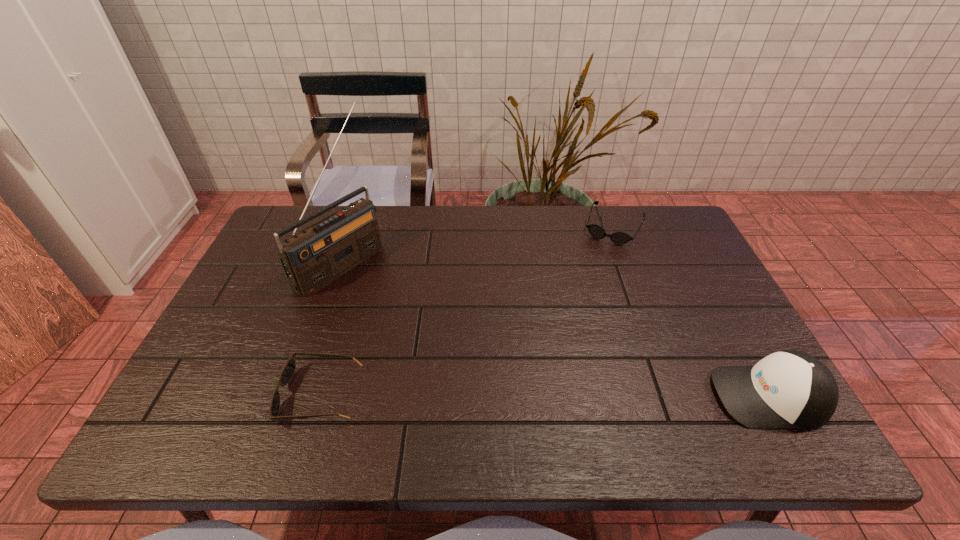
What are the coordinates of `free space on the desktop that is between the nearer sunglasses and the cap and is positioned on the front-facing side of the tallest object` in the screenshot? It's located at (546, 396).

At what (x,y) coordinates should I click in order to perform the action: click on free spot on the desktop that is between the left sunglasses and the cap and is positioned on the lenses of the right sunglasses. Please return your answer as a coordinate pair (x, y). Looking at the image, I should click on (538, 395).